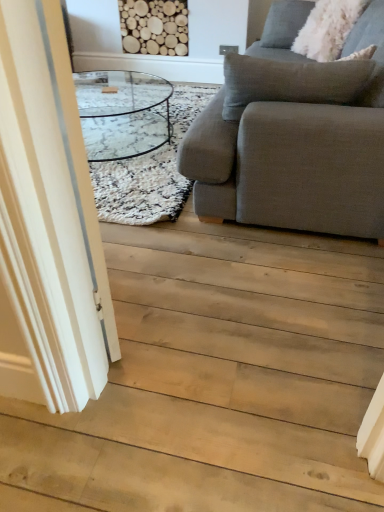
Question: Can you confirm if transparent glass door at left is shorter than gray fabric couch at right?

Choices:
 (A) no
 (B) yes

Answer: (A)

Question: Can you confirm if transparent glass door at left is positioned to the left of gray fabric couch at right?

Choices:
 (A) no
 (B) yes

Answer: (B)

Question: Is transparent glass door at left bigger than gray fabric couch at right?

Choices:
 (A) yes
 (B) no

Answer: (B)

Question: From the image's perspective, would you say transparent glass door at left is positioned over gray fabric couch at right?

Choices:
 (A) yes
 (B) no

Answer: (B)

Question: Is transparent glass door at left facing towards gray fabric couch at right?

Choices:
 (A) no
 (B) yes

Answer: (B)

Question: In the image, is white fluffy pillow at upper right on the left side or the right side of gray fabric couch at right?

Choices:
 (A) left
 (B) right

Answer: (B)

Question: Is white fluffy pillow at upper right bigger or smaller than gray fabric couch at right?

Choices:
 (A) small
 (B) big

Answer: (A)

Question: Choose the correct answer: Is white fluffy pillow at upper right inside gray fabric couch at right or outside it?

Choices:
 (A) inside
 (B) outside

Answer: (A)

Question: From the image's perspective, is white fluffy pillow at upper right located above or below gray fabric couch at right?

Choices:
 (A) below
 (B) above

Answer: (B)

Question: From the image's perspective, relative to white shaggy rug at center, is transparent glass door at left above or below?

Choices:
 (A) above
 (B) below

Answer: (B)

Question: Is transparent glass door at left taller or shorter than white shaggy rug at center?

Choices:
 (A) short
 (B) tall

Answer: (B)

Question: Considering their positions, is transparent glass door at left located in front of or behind white shaggy rug at center?

Choices:
 (A) front
 (B) behind

Answer: (A)

Question: Is transparent glass door at left bigger or smaller than white shaggy rug at center?

Choices:
 (A) small
 (B) big

Answer: (A)

Question: Is point (26, 129) closer or farther from the camera than point (309, 39)?

Choices:
 (A) closer
 (B) farther

Answer: (A)

Question: From a real-world perspective, is transparent glass door at left positioned above or below white fluffy pillow at upper right?

Choices:
 (A) above
 (B) below

Answer: (B)